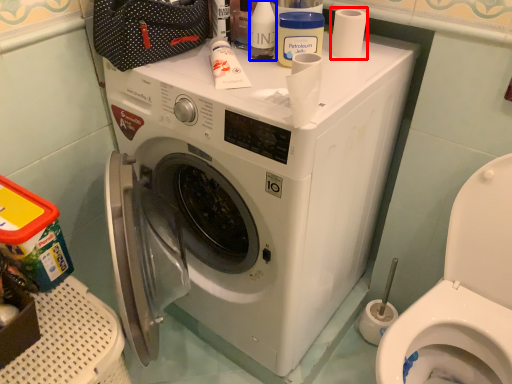
Question: Which of the following is the closest to the observer, toilet paper (highlighted by a red box) or toiletry (highlighted by a blue box)?

Choices:
 (A) toilet paper
 (B) toiletry

Answer: (B)